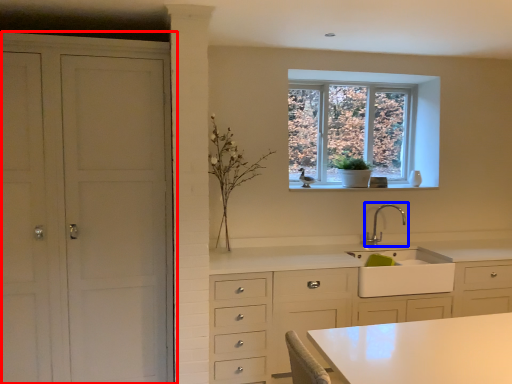
Question: Which point is closer to the camera, cupboard (highlighted by a red box) or tap (highlighted by a blue box)?

Choices:
 (A) cupboard
 (B) tap

Answer: (A)